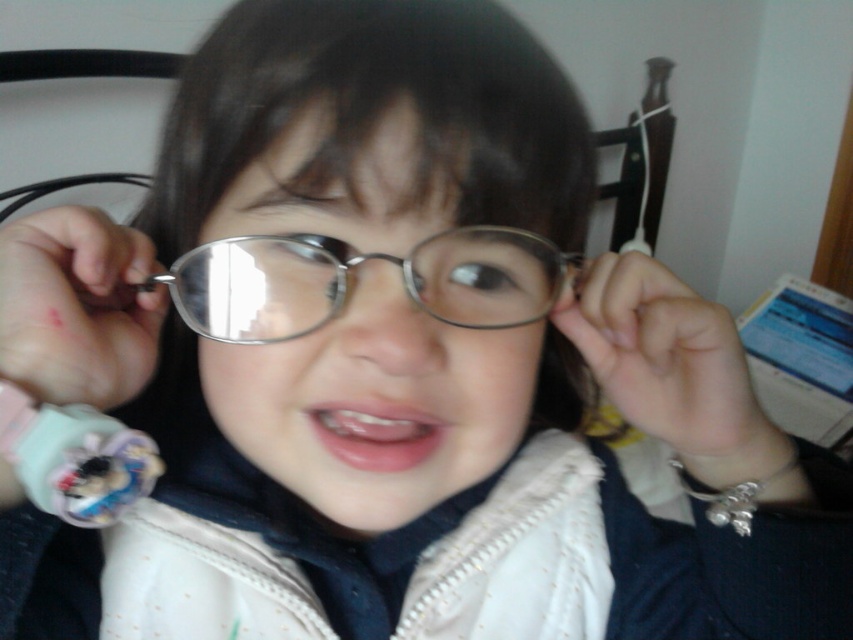
Does point (347, 273) come farther from viewer compared to point (73, 432)?

Yes, point (347, 273) is farther from viewer.

Which is below, metallic round glasses at center or plush fabric toy at lower left?

plush fabric toy at lower left is lower down.

Is point (305, 236) closer to camera compared to point (131, 490)?

Yes, it is in front of point (131, 490).

The image size is (853, 640). I want to click on metallic round glasses at center, so click(x=350, y=285).

Does point (511, 428) lie behind point (140, 451)?

Yes, it is.

Does metallic reflective glasses at center have a greater height compared to plush fabric toy at lower left?

Yes, metallic reflective glasses at center is taller than plush fabric toy at lower left.

Does point (367, 387) lie in front of point (49, 426)?

Yes, it is in front of point (49, 426).

Find the location of `metallic reflective glasses at center`. metallic reflective glasses at center is located at coordinates (364, 340).

Find the location of a particular element. This screenshot has height=640, width=853. metallic reflective glasses at center is located at coordinates tap(364, 340).

Does metallic reflective glasses at center have a lesser height compared to metallic round glasses at center?

Incorrect, metallic reflective glasses at center's height does not fall short of metallic round glasses at center's.

Is point (519, 326) positioned before point (492, 300)?

No, (519, 326) is behind (492, 300).

Image resolution: width=853 pixels, height=640 pixels. Identify the location of metallic reflective glasses at center. (x=364, y=340).